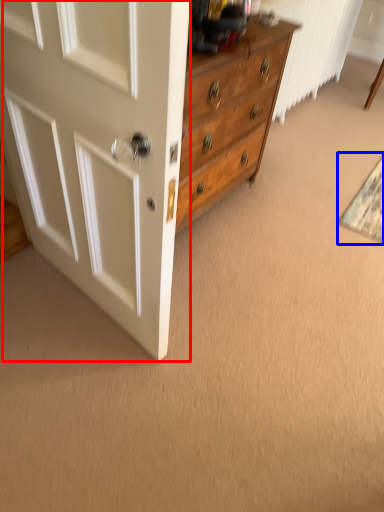
Question: Which of the following is the closest to the observer, door (highlighted by a red box) or doormat (highlighted by a blue box)?

Choices:
 (A) door
 (B) doormat

Answer: (A)